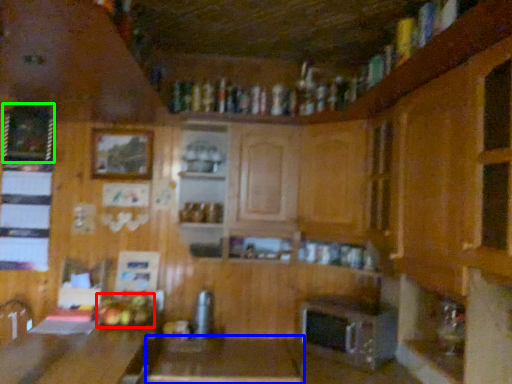
Question: Which is nearer to the food (highlighted by a red box)? table (highlighted by a blue box) or picture frame (highlighted by a green box).

Choices:
 (A) table
 (B) picture frame

Answer: (A)